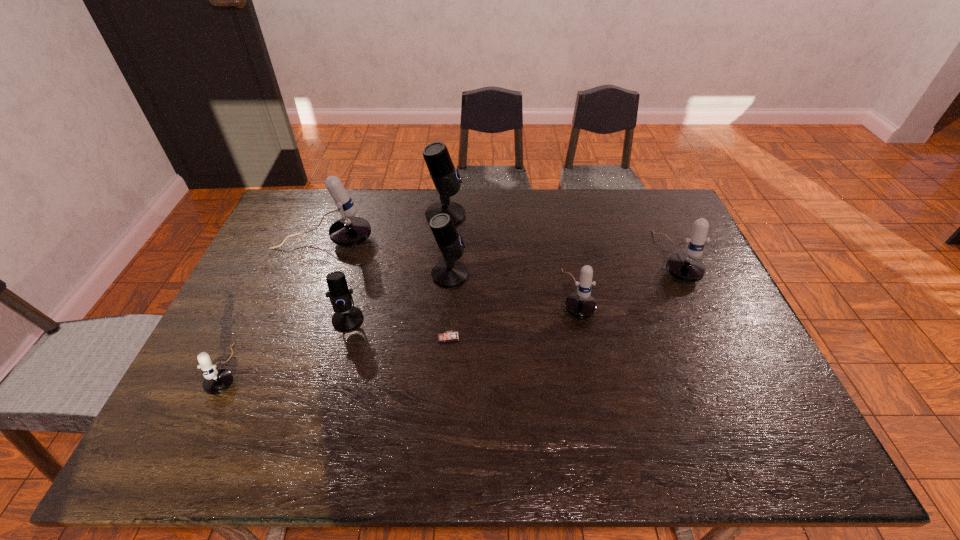
The image size is (960, 540). I want to click on free spot between the nearest microphone and the smallest black microphone, so click(x=289, y=344).

The height and width of the screenshot is (540, 960). What are the coordinates of `vacant space that's between the rightmost object and the third biggest white microphone` in the screenshot? It's located at (625, 276).

Identify the location of free spot between the rightmost white microphone and the biggest white microphone. (498, 249).

The height and width of the screenshot is (540, 960). Find the location of `unoccupied area between the matchbox and the nearest object`. unoccupied area between the matchbox and the nearest object is located at coordinates click(x=339, y=353).

This screenshot has width=960, height=540. What are the coordinates of `free space between the seventh farthest object and the second white microphone from right to left` in the screenshot? It's located at (512, 316).

The image size is (960, 540). I want to click on free space that is in between the biggest black microphone and the leftmost black microphone, so click(396, 267).

The image size is (960, 540). Identify the location of blank region between the farthest microphone and the nearest black microphone. (396, 267).

This screenshot has width=960, height=540. Identify the location of vacant space in between the third white microphone from left to right and the farthest object. (511, 255).

Locate an element on the screen. The image size is (960, 540). free space between the third smallest white microphone and the second object from right to left is located at coordinates (625, 276).

Identify the location of the seventh closest object relative to the nearest black microphone. (687, 267).